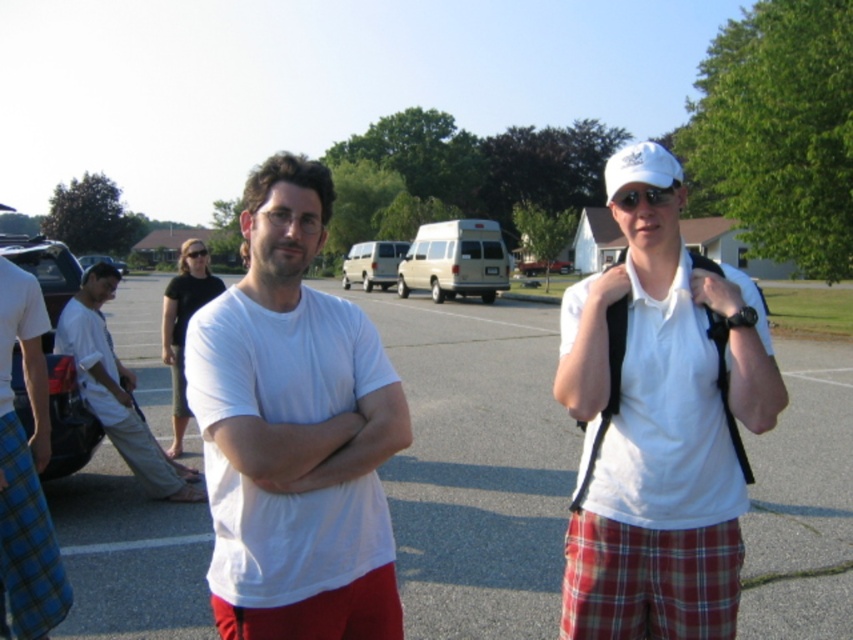
Consider the image. You are a photographer positioned at the back of the scene. You want to take a photo that includes both the blue plaid shorts at lower left and the white cotton shirt at center. Which object will appear larger in your photo?

The blue plaid shorts at lower left will appear larger in the photo because it is closer to the viewer than the white cotton shirt at center.

You are a photographer setting up a shot of the two people in the parking lot. You need to ensure that both the gray asphalt parking lot at center and the matte black glasses at center are visible in the frame. Given their sizes, which object will occupy more space in the photo?

The gray asphalt parking lot at center will occupy more space in the photo because its width is larger than that of the matte black glasses at center.